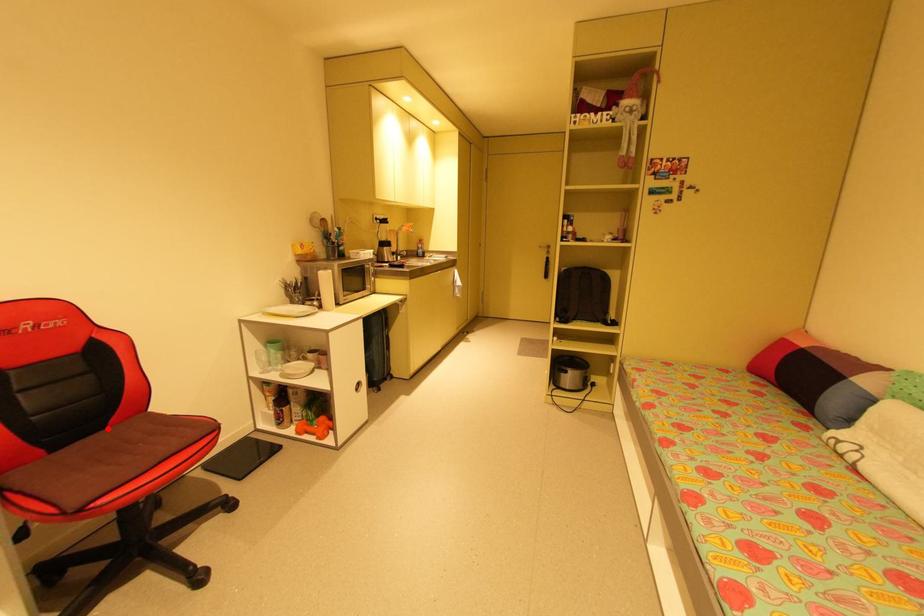
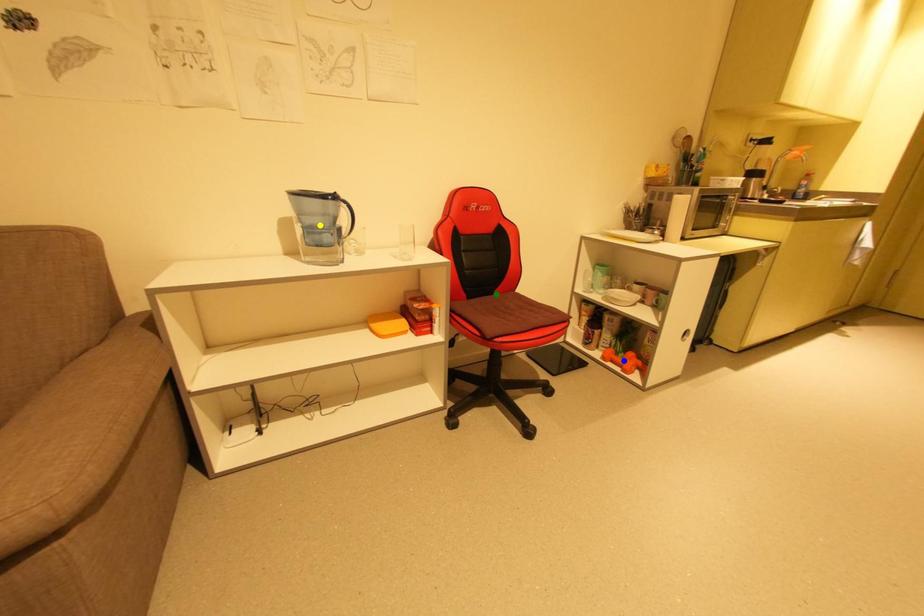
Question: I am providing you with two images of the same scene from different viewpoints. A red point is marked on the first image. You are given multiple points on the second image. Which point in image 2 is actually the same real-world point as the red point in image 1?

Choices:
 (A) yellow point
 (B) green point
 (C) blue point

Answer: (B)